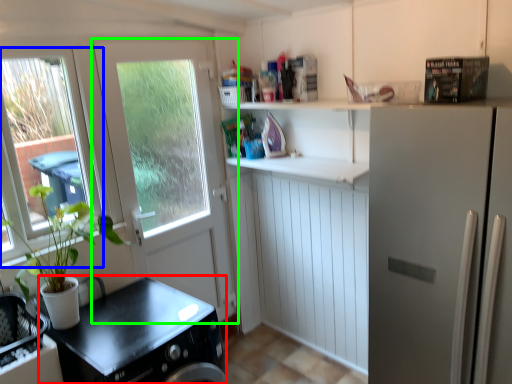
Question: Considering the real-world distances, which object is farthest from counter top (highlighted by a red box)? window (highlighted by a blue box) or door (highlighted by a green box)?

Choices:
 (A) window
 (B) door

Answer: (A)